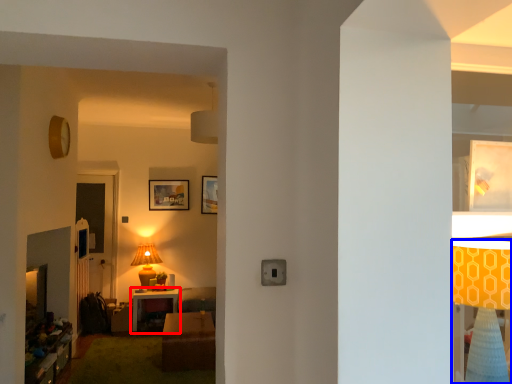
Question: Among these objects, which one is farthest to the camera, table (highlighted by a red box) or lamp (highlighted by a blue box)?

Choices:
 (A) table
 (B) lamp

Answer: (A)